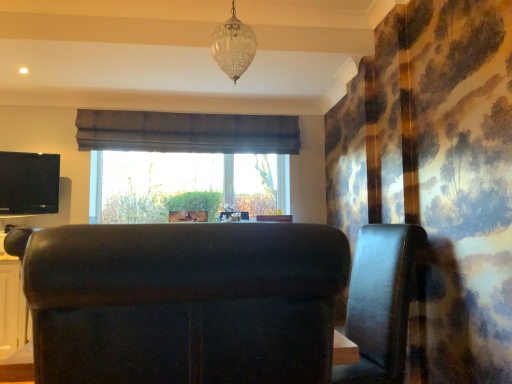
Question: In which direction should I rotate to look at leather armchair at center, arranged as the second furniture when viewed from the left?

Choices:
 (A) left
 (B) right

Answer: (B)

Question: Is clear glass chandelier at upper center placed right next to velvet dark brown armchair at center, acting as the second furniture starting from the right?

Choices:
 (A) yes
 (B) no

Answer: (B)

Question: Does clear glass chandelier at upper center have a greater height compared to velvet dark brown armchair at center, positioned as the first furniture in front-to-back order?

Choices:
 (A) no
 (B) yes

Answer: (B)

Question: Could velvet dark brown armchair at center, which appears as the second furniture when viewed from the back, be considered to be inside clear glass chandelier at upper center?

Choices:
 (A) yes
 (B) no

Answer: (B)

Question: Is clear glass chandelier at upper center facing towards velvet dark brown armchair at center, arranged as the first furniture when viewed from the left?

Choices:
 (A) no
 (B) yes

Answer: (A)

Question: Is velvet dark brown armchair at center, which appears as the second furniture when viewed from the back, at the back of clear glass chandelier at upper center?

Choices:
 (A) no
 (B) yes

Answer: (A)

Question: From a real-world perspective, is clear glass chandelier at upper center below velvet dark brown armchair at center, positioned as the first furniture in front-to-back order?

Choices:
 (A) no
 (B) yes

Answer: (A)

Question: Is the depth of brown fabric curtain at center less than that of velvet dark brown armchair at center, positioned as the first furniture in front-to-back order?

Choices:
 (A) no
 (B) yes

Answer: (A)

Question: Could you tell me if brown fabric curtain at center is facing velvet dark brown armchair at center, arranged as the first furniture when viewed from the left?

Choices:
 (A) yes
 (B) no

Answer: (B)

Question: Is brown fabric curtain at center not near velvet dark brown armchair at center, positioned as the first furniture in front-to-back order?

Choices:
 (A) no
 (B) yes

Answer: (B)

Question: Is brown fabric curtain at center touching velvet dark brown armchair at center, arranged as the first furniture when viewed from the left?

Choices:
 (A) yes
 (B) no

Answer: (B)

Question: Is brown fabric curtain at center turned away from velvet dark brown armchair at center, arranged as the first furniture when viewed from the left?

Choices:
 (A) no
 (B) yes

Answer: (A)

Question: Is brown fabric curtain at center wider than velvet dark brown armchair at center, arranged as the first furniture when viewed from the left?

Choices:
 (A) no
 (B) yes

Answer: (A)

Question: Is velvet dark brown armchair at center, positioned as the first furniture in front-to-back order, thinner than leather armchair at center, acting as the second furniture starting from the front?

Choices:
 (A) no
 (B) yes

Answer: (B)